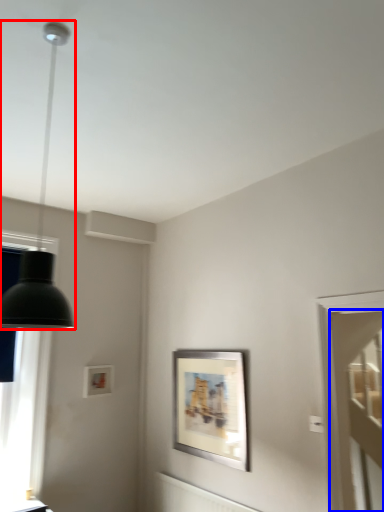
Question: Which of the following is the farthest to the observer, lamp (highlighted by a red box) or glass door (highlighted by a blue box)?

Choices:
 (A) lamp
 (B) glass door

Answer: (B)